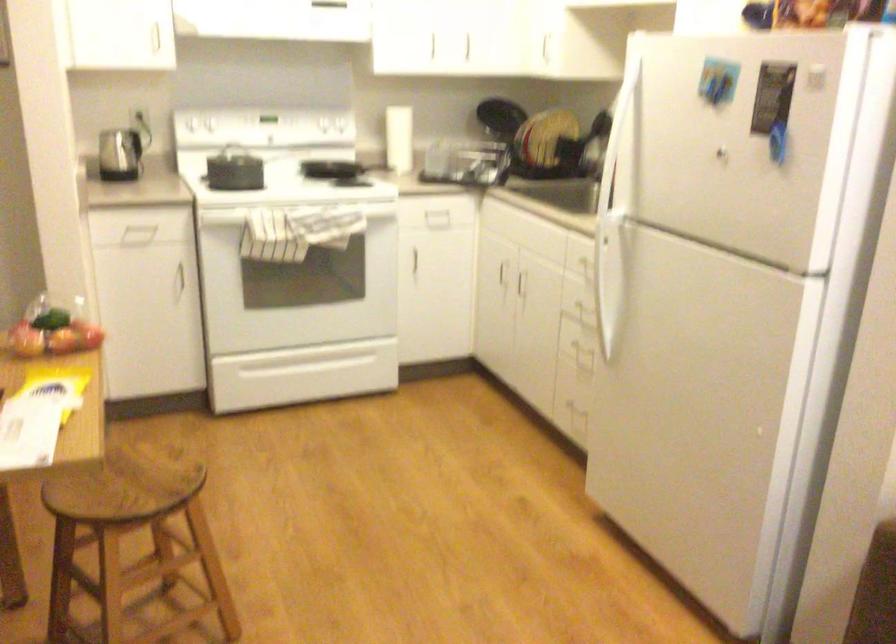
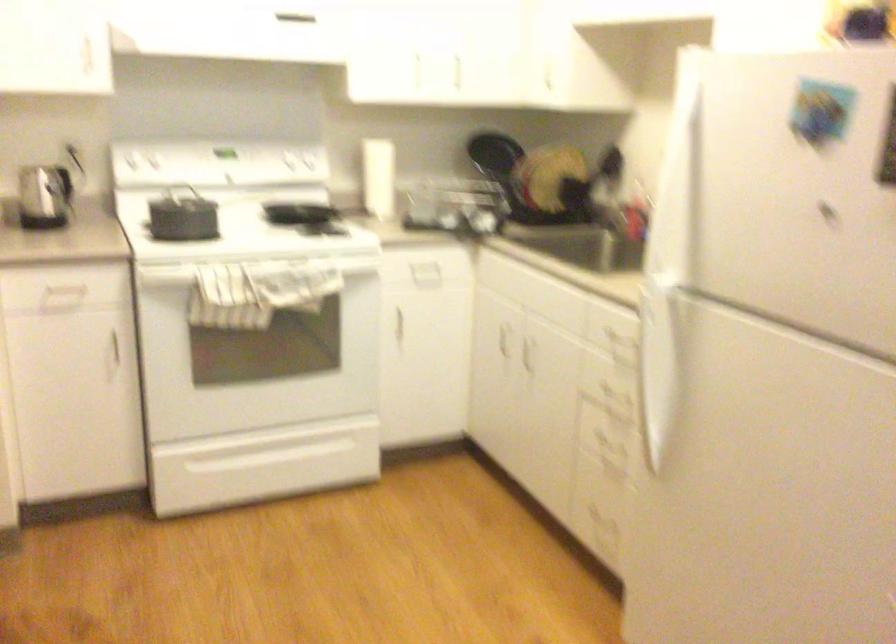
The point at (209, 127) is marked in the first image. Where is the corresponding point in the second image?

(158, 171)